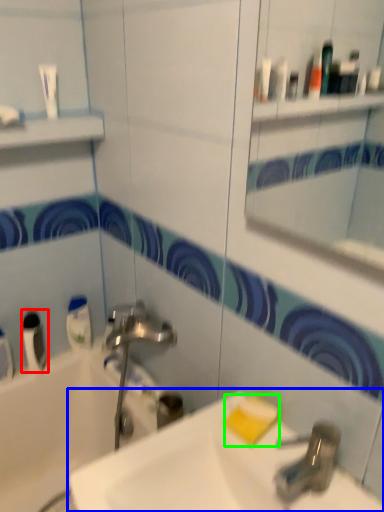
Question: Based on their relative distances, which object is farther from mouthwash (highlighted by a red box)? Choose from sink (highlighted by a blue box) and soap (highlighted by a green box).

Choices:
 (A) sink
 (B) soap

Answer: (B)